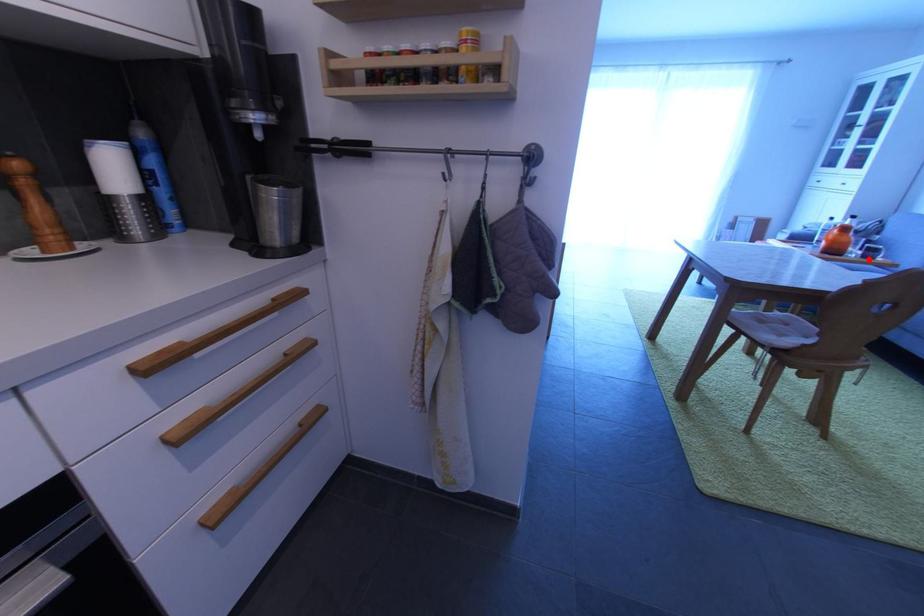
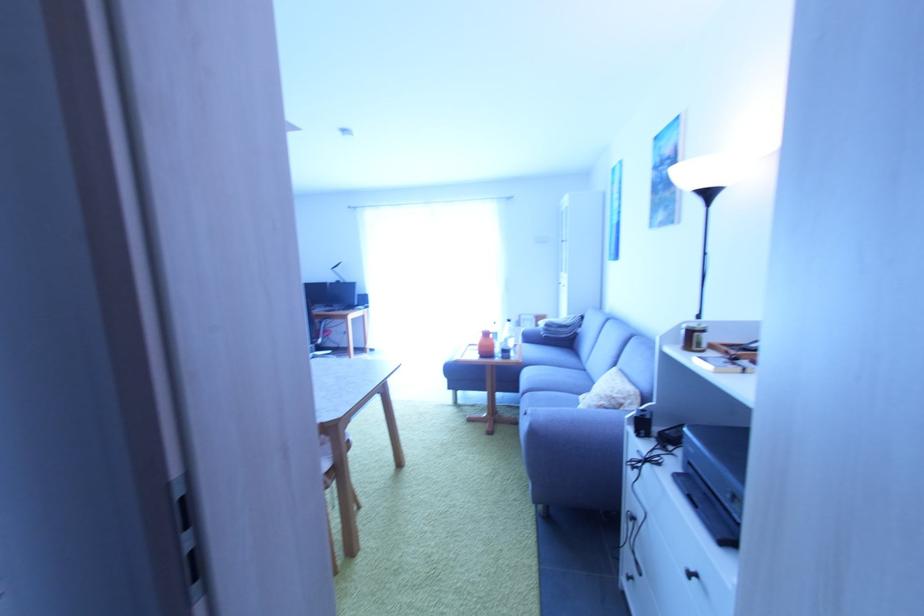
The point at the highlighted location is marked in the first image. Where is the corresponding point in the second image?

(507, 360)